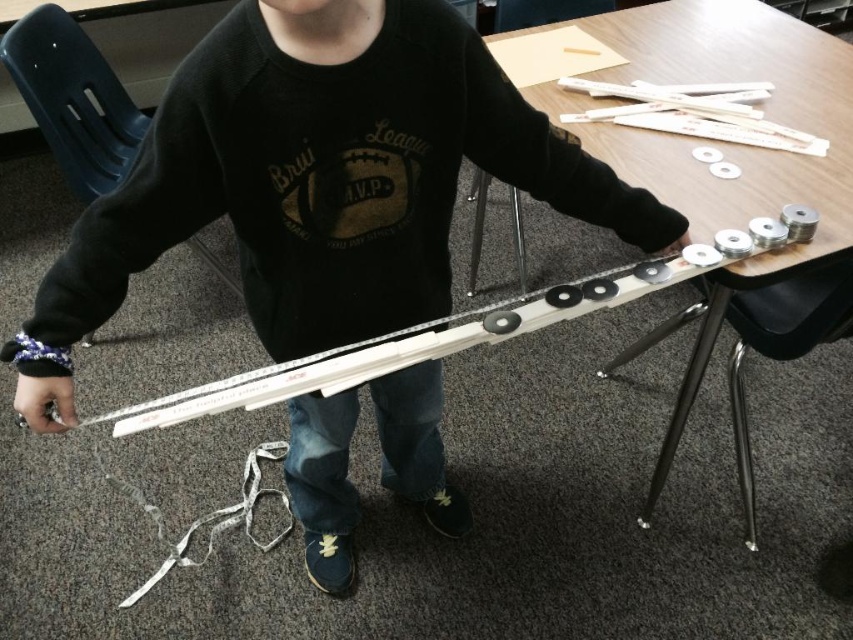
Is point (662, 467) closer to camera compared to point (680, 243)?

No, it is not.

Can you confirm if wooden table at center is bigger than matte black hand at upper center?

Yes, wooden table at center is bigger than matte black hand at upper center.

At what (x,y) coordinates should I click in order to perform the action: click on wooden table at center. Please return your answer as a coordinate pair (x, y). The image size is (853, 640). Looking at the image, I should click on (729, 154).

Where is `wooden table at center`? The image size is (853, 640). wooden table at center is located at coordinates (729, 154).

Is wooden table at center to the left of matte black hand at lower left from the viewer's perspective?

Incorrect, wooden table at center is not on the left side of matte black hand at lower left.

Identify the location of wooden table at center. (729, 154).

Which is behind, point (717, 58) or point (57, 429)?

The point (717, 58) is behind.

Find the location of a particular element. The width and height of the screenshot is (853, 640). wooden table at center is located at coordinates (729, 154).

Does matte black hand at lower left come in front of matte black hand at upper center?

Yes, matte black hand at lower left is in front of matte black hand at upper center.

Between matte black hand at lower left and matte black hand at upper center, which one appears on the right side from the viewer's perspective?

Positioned to the right is matte black hand at upper center.

Is point (33, 420) more distant than point (660, 252)?

That is False.

Locate an element on the screen. This screenshot has height=640, width=853. matte black hand at lower left is located at coordinates (45, 403).